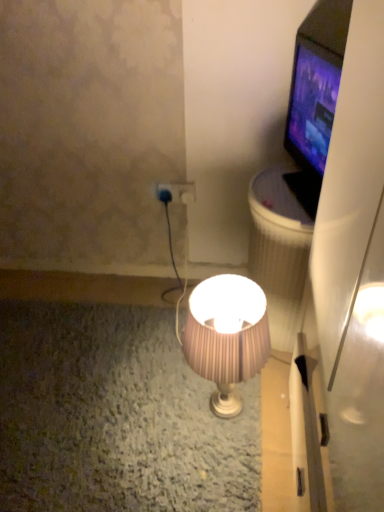
Question: Can you confirm if pink pleated fabric lampshade at center is positioned to the left of blue plastic plug at center?

Choices:
 (A) no
 (B) yes

Answer: (A)

Question: Is pink pleated fabric lampshade at center shorter than blue plastic plug at center?

Choices:
 (A) no
 (B) yes

Answer: (A)

Question: From a real-world perspective, is pink pleated fabric lampshade at center located beneath blue plastic plug at center?

Choices:
 (A) yes
 (B) no

Answer: (A)

Question: Is the depth of pink pleated fabric lampshade at center greater than that of blue plastic plug at center?

Choices:
 (A) no
 (B) yes

Answer: (A)

Question: Is pink pleated fabric lampshade at center far away from blue plastic plug at center?

Choices:
 (A) no
 (B) yes

Answer: (A)

Question: From the image's perspective, would you say pink pleated fabric lampshade at center is shown under blue plastic plug at center?

Choices:
 (A) yes
 (B) no

Answer: (A)

Question: Is the position of matte black tv at upper right less distant than that of blue plastic plug at center?

Choices:
 (A) no
 (B) yes

Answer: (B)

Question: Is matte black tv at upper right not within blue plastic plug at center?

Choices:
 (A) no
 (B) yes

Answer: (B)

Question: Is matte black tv at upper right further to camera compared to blue plastic plug at center?

Choices:
 (A) no
 (B) yes

Answer: (A)

Question: From a real-world perspective, does matte black tv at upper right stand above blue plastic plug at center?

Choices:
 (A) yes
 (B) no

Answer: (A)

Question: From a real-world perspective, is matte black tv at upper right located beneath blue plastic plug at center?

Choices:
 (A) no
 (B) yes

Answer: (A)

Question: Can you confirm if matte black tv at upper right is taller than blue plastic plug at center?

Choices:
 (A) yes
 (B) no

Answer: (A)

Question: Can we say matte black tv at upper right lies outside pink pleated fabric lampshade at center?

Choices:
 (A) no
 (B) yes

Answer: (B)